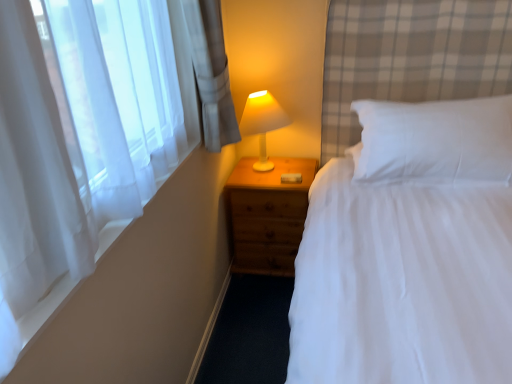
Question: Is sheer white curtain at left located within white soft pillow at upper right?

Choices:
 (A) no
 (B) yes

Answer: (A)

Question: Considering the relative sizes of white soft pillow at upper right and sheer white curtain at left in the image provided, is white soft pillow at upper right thinner than sheer white curtain at left?

Choices:
 (A) yes
 (B) no

Answer: (B)

Question: Can you confirm if white soft pillow at upper right is bigger than sheer white curtain at left?

Choices:
 (A) yes
 (B) no

Answer: (A)

Question: Is sheer white curtain at left at the back of white soft pillow at upper right?

Choices:
 (A) yes
 (B) no

Answer: (B)

Question: Does white soft pillow at upper right come behind sheer white curtain at left?

Choices:
 (A) yes
 (B) no

Answer: (A)

Question: From the image's perspective, is white soft pillow at upper right beneath sheer white curtain at left?

Choices:
 (A) yes
 (B) no

Answer: (B)

Question: Could you tell me if white plastic lamp at upper right is turned towards wooden nightstand at center?

Choices:
 (A) no
 (B) yes

Answer: (A)

Question: From the image's perspective, is white plastic lamp at upper right on wooden nightstand at center?

Choices:
 (A) no
 (B) yes

Answer: (B)

Question: Does white plastic lamp at upper right lie in front of wooden nightstand at center?

Choices:
 (A) yes
 (B) no

Answer: (A)

Question: Considering the relative positions of white plastic lamp at upper right and wooden nightstand at center in the image provided, is white plastic lamp at upper right behind wooden nightstand at center?

Choices:
 (A) yes
 (B) no

Answer: (B)

Question: From a real-world perspective, is white plastic lamp at upper right beneath wooden nightstand at center?

Choices:
 (A) no
 (B) yes

Answer: (A)

Question: Considering the relative sizes of white plastic lamp at upper right and wooden nightstand at center in the image provided, is white plastic lamp at upper right thinner than wooden nightstand at center?

Choices:
 (A) no
 (B) yes

Answer: (B)

Question: Does white plastic lamp at upper right have a greater height compared to sheer white curtain at left?

Choices:
 (A) no
 (B) yes

Answer: (B)